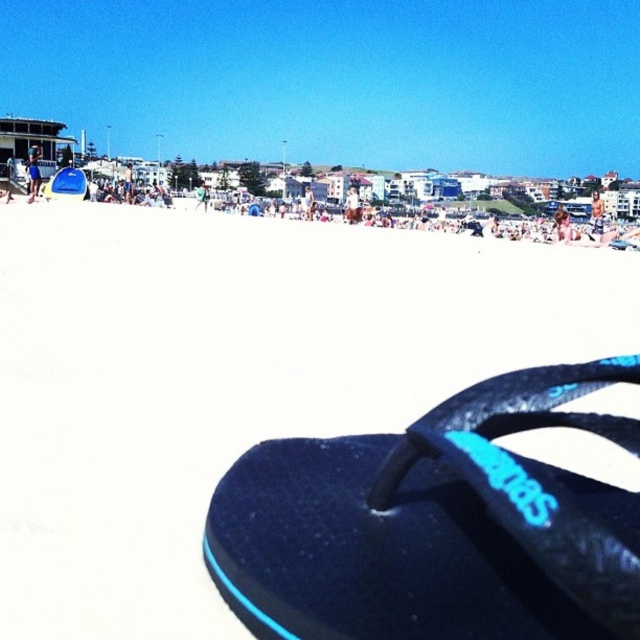
Between point (474, 620) and point (189, 196), which one is positioned behind?

The point (189, 196) is more distant.

Who is shorter, black rubber sandal at lower right or white sand at center?

black rubber sandal at lower right is shorter.

Is point (422, 593) closer to viewer compared to point (637, 243)?

That is True.

Locate an element on the screen. black rubber sandal at lower right is located at coordinates (435, 524).

Where is `white sand at lower center`? This screenshot has width=640, height=640. white sand at lower center is located at coordinates (228, 371).

Between white sand at lower center and white sand at center, which one is positioned higher?

white sand at center is higher up.

Which is behind, point (144, 413) or point (432, 216)?

Point (432, 216)

Find the location of a particular element. This screenshot has height=640, width=640. white sand at lower center is located at coordinates (228, 371).

Can you confirm if white sand at lower center is smaller than black rubber sandal at lower right?

Indeed, white sand at lower center has a smaller size compared to black rubber sandal at lower right.

The image size is (640, 640). What do you see at coordinates (228, 371) in the screenshot?
I see `white sand at lower center` at bounding box center [228, 371].

Identify the location of white sand at lower center. The image size is (640, 640). (228, 371).